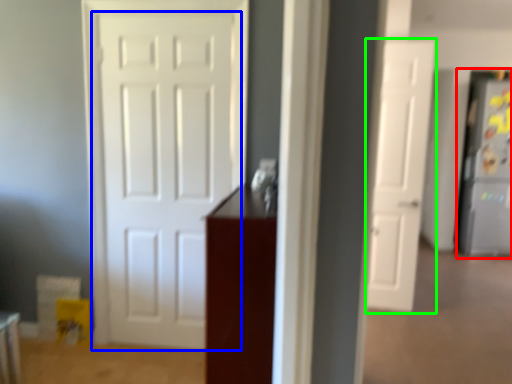
Question: Based on their relative distances, which object is nearer to fridge (highlighted by a red box)? Choose from door (highlighted by a blue box) and door (highlighted by a green box).

Choices:
 (A) door
 (B) door

Answer: (B)